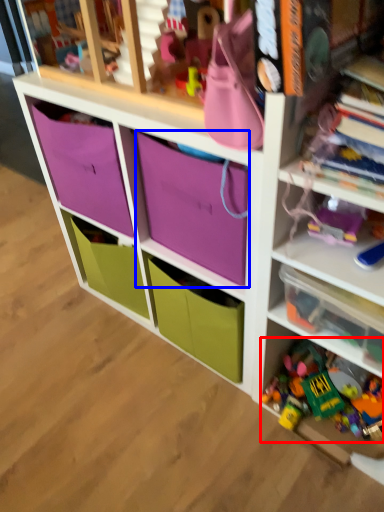
Question: Which object appears closest to the camera in this image, toy (highlighted by a red box) or storage box (highlighted by a blue box)?

Choices:
 (A) toy
 (B) storage box

Answer: (B)